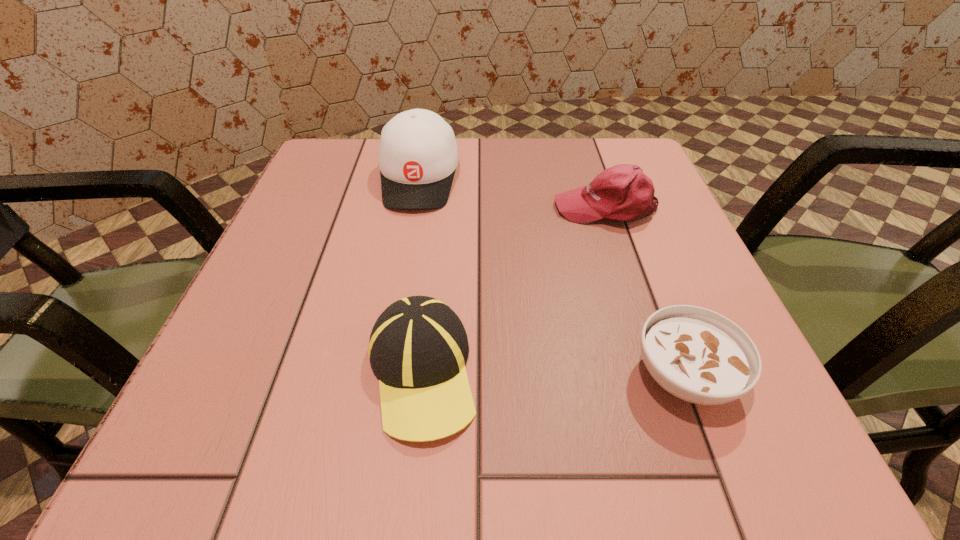
Where is `vacant space at the right edge of the desktop`? vacant space at the right edge of the desktop is located at coordinates (699, 257).

Identify the location of free region at the far left corner. This screenshot has width=960, height=540. (326, 170).

In the image, there is a desktop. At what (x,y) coordinates should I click in order to perform the action: click on vacant space at the near right corner. Please return your answer as a coordinate pair (x, y). This screenshot has width=960, height=540. Looking at the image, I should click on coord(719,425).

You are a GUI agent. You are given a task and a screenshot of the screen. Output one action in this format:
    pyautogui.click(x=<x>, y=<y>)
    Task: Click on the vacant space in between the soup bowl and the tallest object
    Image resolution: width=960 pixels, height=540 pixels.
    Given the screenshot: What is the action you would take?
    pyautogui.click(x=551, y=278)

Where is `empty space between the shortest object and the tallest object`? The height and width of the screenshot is (540, 960). empty space between the shortest object and the tallest object is located at coordinates tap(551, 278).

Where is `vacant region between the soup bowl and the nearest baseball cap`? vacant region between the soup bowl and the nearest baseball cap is located at coordinates (553, 374).

The width and height of the screenshot is (960, 540). Find the location of `empty space that is in between the nearest baseball cap and the tallest baseball cap`. empty space that is in between the nearest baseball cap and the tallest baseball cap is located at coordinates (420, 276).

Where is `free space between the nearest baseball cap and the rightmost baseball cap`? The height and width of the screenshot is (540, 960). free space between the nearest baseball cap and the rightmost baseball cap is located at coordinates (514, 290).

The width and height of the screenshot is (960, 540). Identify the location of unoccupied position between the tallest object and the nearest baseball cap. (420, 276).

Locate an element on the screen. The image size is (960, 540). free area in between the shortest object and the rightmost baseball cap is located at coordinates (645, 292).